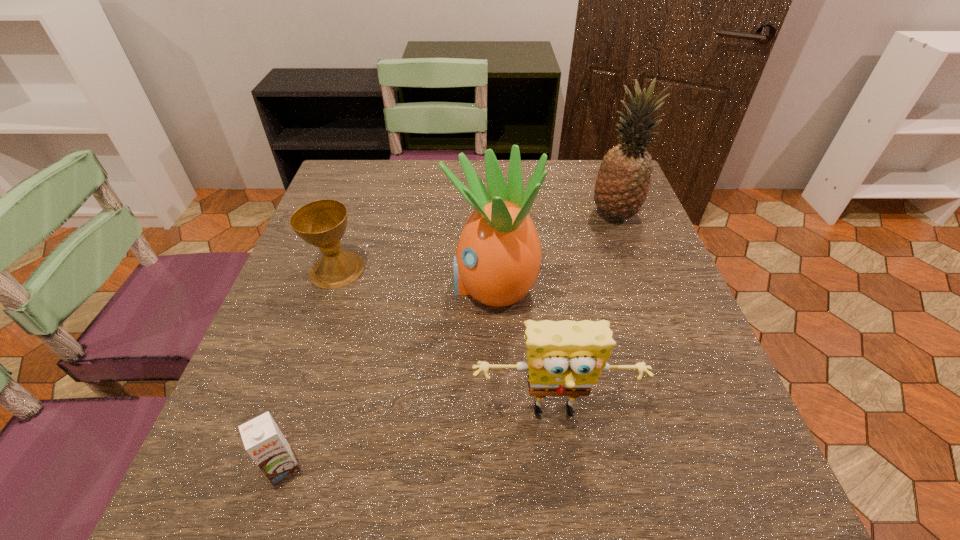
Find the location of a particular element. The image size is (960, 540). the farthest object is located at coordinates (622, 185).

Image resolution: width=960 pixels, height=540 pixels. In order to click on the farther pineapple in this screenshot , I will do `click(622, 185)`.

Where is `the left pineapple`? The height and width of the screenshot is (540, 960). the left pineapple is located at coordinates click(x=498, y=256).

I want to click on the second nearest object, so click(x=565, y=358).

Find the location of a particular element. the third shortest object is located at coordinates (565, 358).

Identify the location of the fourth tallest object. (322, 223).

Identify the location of chocolate milk. (263, 440).

The height and width of the screenshot is (540, 960). In order to click on the shortest object in this screenshot , I will do `click(263, 440)`.

Locate an element on the screen. The width and height of the screenshot is (960, 540). vacant region located on the front of the farthest object is located at coordinates (662, 345).

You are a GUI agent. You are given a task and a screenshot of the screen. Output one action in this format:
    pyautogui.click(x=<x>, y=<y>)
    Task: Click on the vacant space located at the entrance of the left pineapple
    Image resolution: width=960 pixels, height=540 pixels.
    Given the screenshot: What is the action you would take?
    pyautogui.click(x=425, y=285)